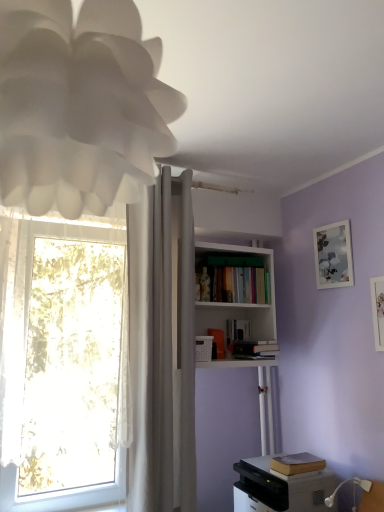
Question: Is point (301, 454) positioned closer to the camera than point (248, 342)?

Choices:
 (A) farther
 (B) closer

Answer: (B)

Question: From the image's perspective, is brown leather book at lower right, the first book positioned from the bottom, located above or below hardcover book at upper center, which appears as the fourth book when viewed from the top?

Choices:
 (A) above
 (B) below

Answer: (B)

Question: Which object is the farthest from the gray matte printer at lower right?

Choices:
 (A) brown leather book at lower right, arranged as the fifth book when viewed from the top
 (B) hardcover books at center, the 5th book positioned from the bottom
 (C) matte white picture frame at upper right, which appears as the second picture frame when viewed from the left
 (D) white fabric curtain at center
 (E) hardcover book at upper center, which is counted as the 2th book, starting from the bottom

Answer: (B)

Question: Estimate the real-world distances between objects in this image. Which object is farther from the white fabric curtain at center?

Choices:
 (A) white paper lampshade at upper left
 (B) gray matte printer at lower right
 (C) white matte bookcase at upper center
 (D) brown leather book at lower right, arranged as the fifth book when viewed from the top
 (E) hardcover books at center, which is the 1th book in top-to-bottom order

Answer: (A)